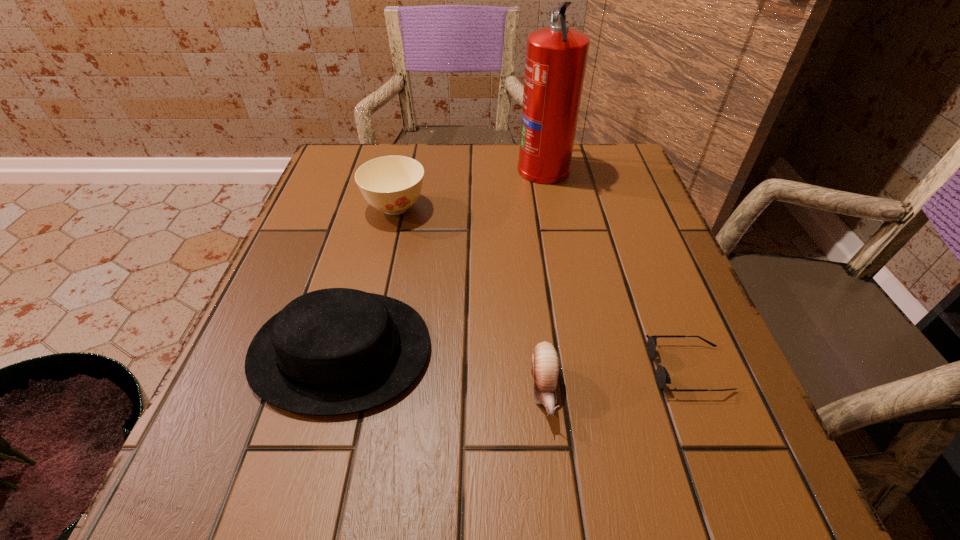
Locate an element on the screen. This screenshot has height=540, width=960. free space located 0.240m on the front of the second farthest object is located at coordinates (372, 313).

The image size is (960, 540). In order to click on free space located on the front of the fedora in this screenshot , I will do `click(297, 517)`.

Locate an element on the screen. vacant space located 0.090m on the front-facing side of the fourth tallest object is located at coordinates (556, 491).

In order to click on vacant area situated 0.200m on the front-facing side of the sunglasses in this screenshot , I will do `click(526, 369)`.

Identify the location of vacant region located 0.190m on the front-facing side of the sunglasses. This screenshot has height=540, width=960. (533, 369).

Locate an element on the screen. vacant area located on the front-facing side of the sunglasses is located at coordinates (545, 369).

Locate an element on the screen. This screenshot has width=960, height=540. fire extinguisher present at the far edge is located at coordinates (556, 56).

Find the location of a particular element. This screenshot has width=960, height=540. sugar bowl that is at the far edge is located at coordinates click(392, 184).

Locate an element on the screen. This screenshot has width=960, height=540. sugar bowl that is at the left edge is located at coordinates (392, 184).

The height and width of the screenshot is (540, 960). In order to click on fedora that is at the left edge in this screenshot , I will do `click(334, 351)`.